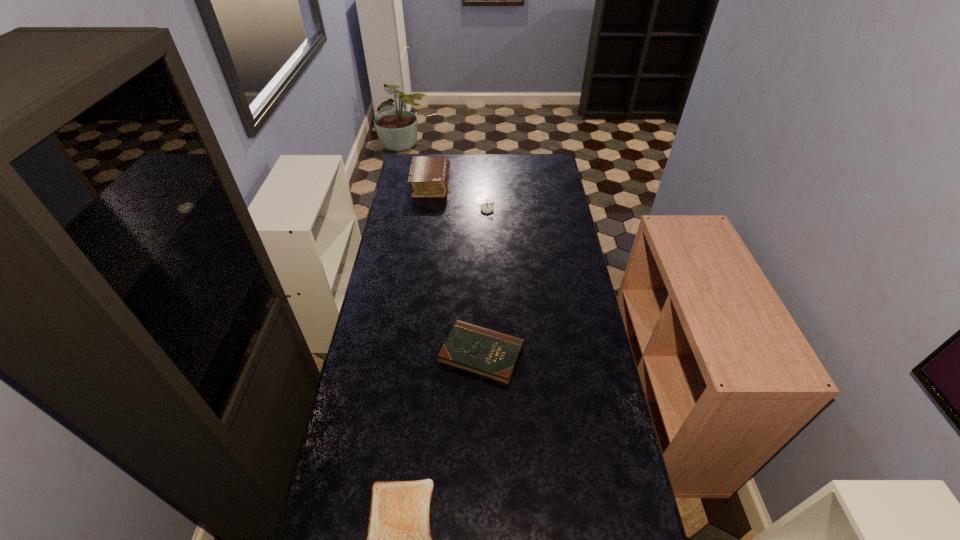
Identify which object is the second closest to the third tallest object. Please provide its 2D coordinates. Your answer should be formatted as a tuple, i.e. [(x, y)], where the tuple contains the x and y coordinates of a point satisfying the conditions above.

[(486, 207)]

This screenshot has width=960, height=540. Identify the location of free point that satisfies the following two spatial constraints: 1. on the back side of the second shortest object; 2. on the spine side of the tallest object. point(481,185).

This screenshot has width=960, height=540. In order to click on free location that satisfies the following two spatial constraints: 1. on the spine side of the compass; 2. on the right side of the taller Bible in this screenshot , I will do `click(427, 209)`.

This screenshot has height=540, width=960. I want to click on free space that satisfies the following two spatial constraints: 1. on the spine side of the third farthest object; 2. on the left side of the left Bible, so click(407, 354).

This screenshot has height=540, width=960. Identify the location of vacant region that satisfies the following two spatial constraints: 1. on the spine side of the shorter Bible; 2. on the right side of the tallest object. (407, 354).

Locate an element on the screen. free space that satisfies the following two spatial constraints: 1. on the back side of the second tallest object; 2. on the spine side of the taller Bible is located at coordinates click(486, 185).

This screenshot has height=540, width=960. Identify the location of free space that satisfies the following two spatial constraints: 1. on the spine side of the tallest object; 2. on the back side of the second shortest object. (407, 354).